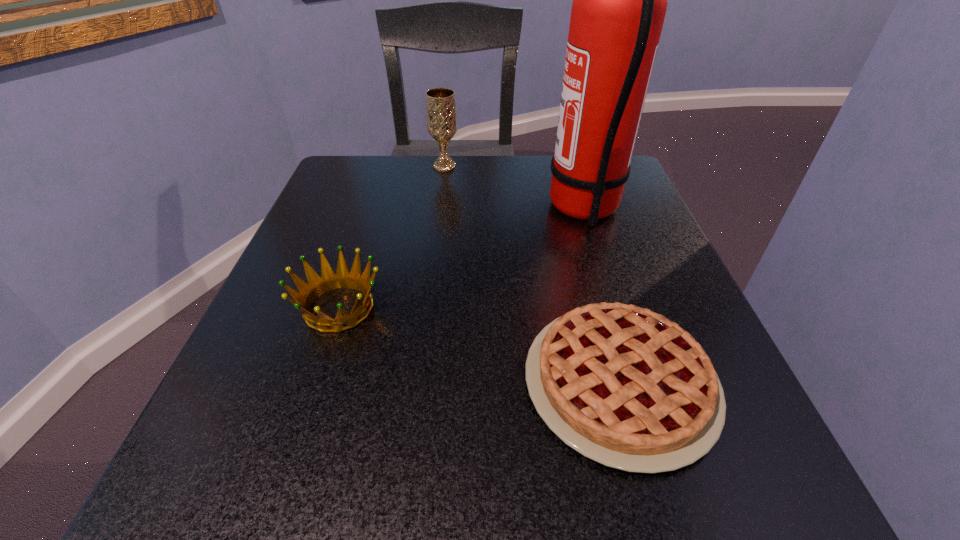
Image resolution: width=960 pixels, height=540 pixels. What are the coordinates of `free location that satisfies the following two spatial constraints: 1. on the front side of the farthest object; 2. on the right side of the shortest object` in the screenshot? It's located at (418, 383).

This screenshot has width=960, height=540. Find the location of `free space in the image that satisfies the following two spatial constraints: 1. on the handle side of the tallest object; 2. on the front side of the shortest object`. free space in the image that satisfies the following two spatial constraints: 1. on the handle side of the tallest object; 2. on the front side of the shortest object is located at coordinates (640, 383).